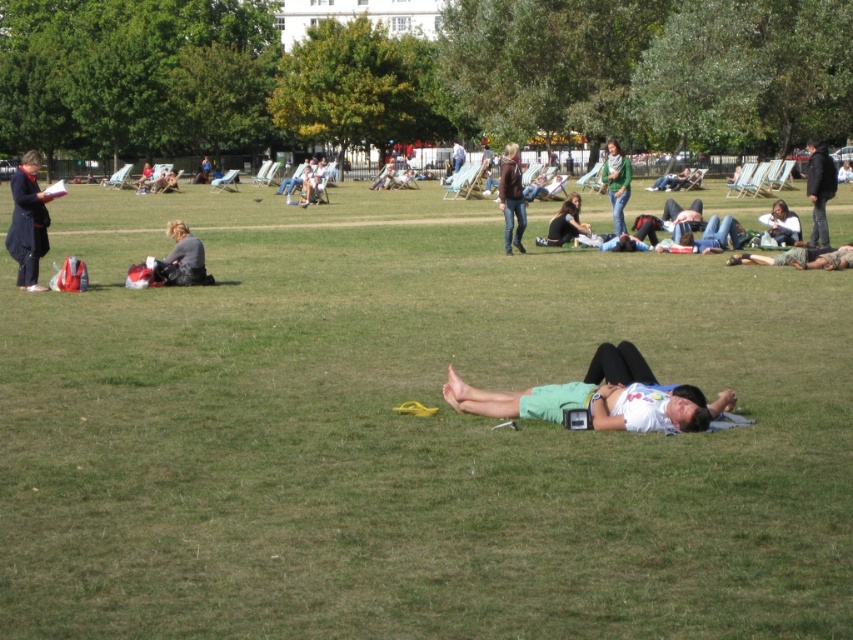
Which of these two, white matte shirt at center or green knitted sweater at center, stands shorter?

With less height is white matte shirt at center.

Is white matte shirt at center taller than green knitted sweater at center?

No.

The width and height of the screenshot is (853, 640). What are the coordinates of `white matte shirt at center` in the screenshot? It's located at (599, 396).

Can you confirm if white matte shirt at center is bigger than dark blue jacket at right?

Actually, white matte shirt at center might be smaller than dark blue jacket at right.

Can you confirm if white matte shirt at center is shorter than dark blue jacket at right?

Yes.

The width and height of the screenshot is (853, 640). Describe the element at coordinates (599, 396) in the screenshot. I see `white matte shirt at center` at that location.

Where is `white matte shirt at center`? The height and width of the screenshot is (640, 853). white matte shirt at center is located at coordinates (599, 396).

Does point (819, 412) come closer to viewer compared to point (30, 152)?

That is True.

At what (x,y) coordinates should I click in order to perform the action: click on green grass at center. Please return your answer as a coordinate pair (x, y). This screenshot has height=640, width=853. Looking at the image, I should click on (407, 433).

Is point (527, 515) positioned before point (10, 228)?

That is True.

The width and height of the screenshot is (853, 640). I want to click on green grass at center, so click(407, 433).